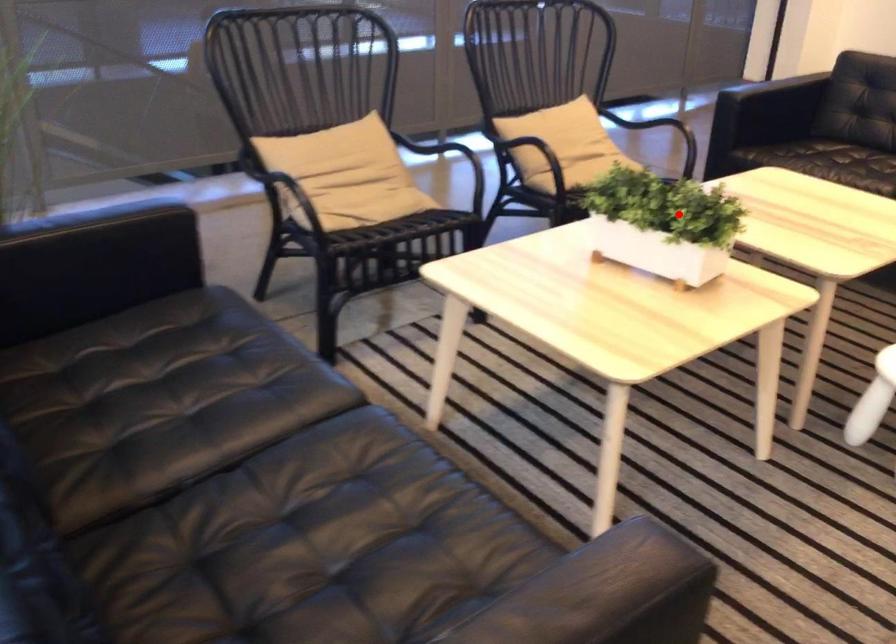
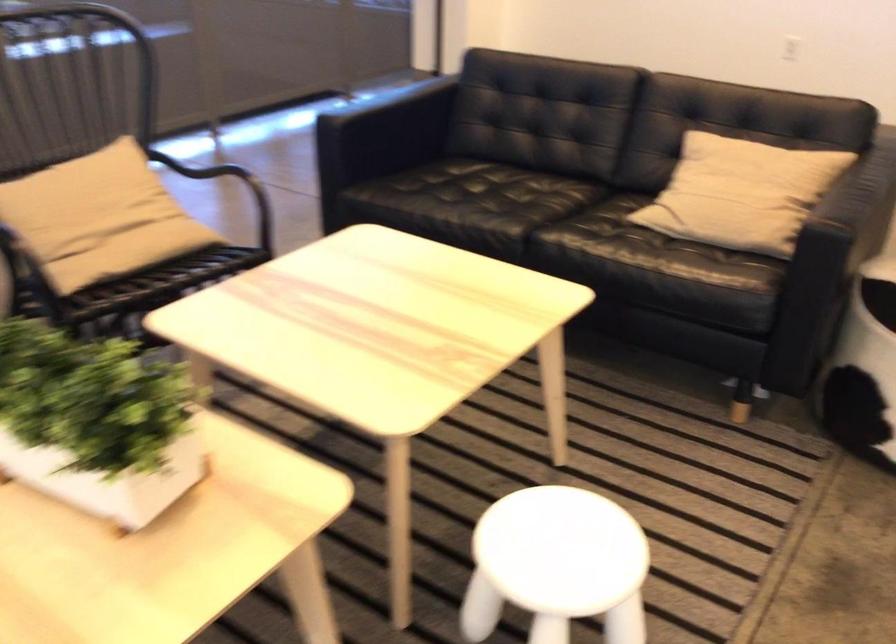
Question: I am providing you with two images of the same scene from different viewpoints. A red point is shown in image1. For the corresponding object point in image2, is it positioned nearer or farther from the camera?

Choices:
 (A) Nearer
 (B) Farther

Answer: (A)